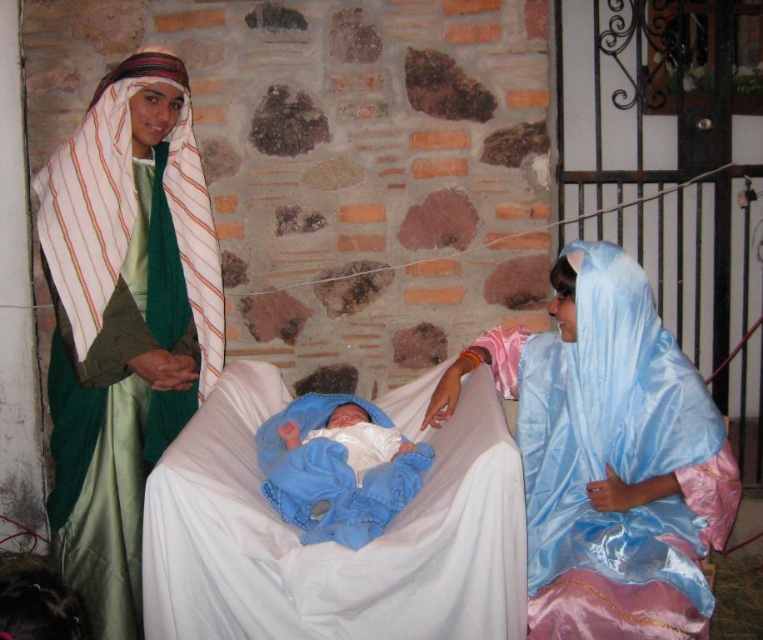
This screenshot has width=763, height=640. What are the coordinates of `white satin infant bed at center` in the screenshot? It's located at (332, 544).

Is point (440, 502) positioned before point (394, 465)?

Yes, point (440, 502) is closer to viewer.

Locate an element on the screen. The width and height of the screenshot is (763, 640). white satin infant bed at center is located at coordinates (332, 544).

Can you confirm if silky blue fabric at center is thinner than blue satin newborn at center?

No.

Does point (137, 220) lie in front of point (378, 436)?

No, it is behind (378, 436).

Image resolution: width=763 pixels, height=640 pixels. In order to click on silky blue fabric at center in this screenshot , I will do `click(124, 321)`.

Describe the element at coordinates (609, 456) in the screenshot. I see `satin blue fabric at right` at that location.

Between satin blue fabric at right and blue satin newborn at center, which one is positioned lower?

satin blue fabric at right is lower down.

Who is more distant from viewer, (694,605) or (378,452)?

The point (378,452) is more distant.

Find the location of a particular element. satin blue fabric at right is located at coordinates (609, 456).